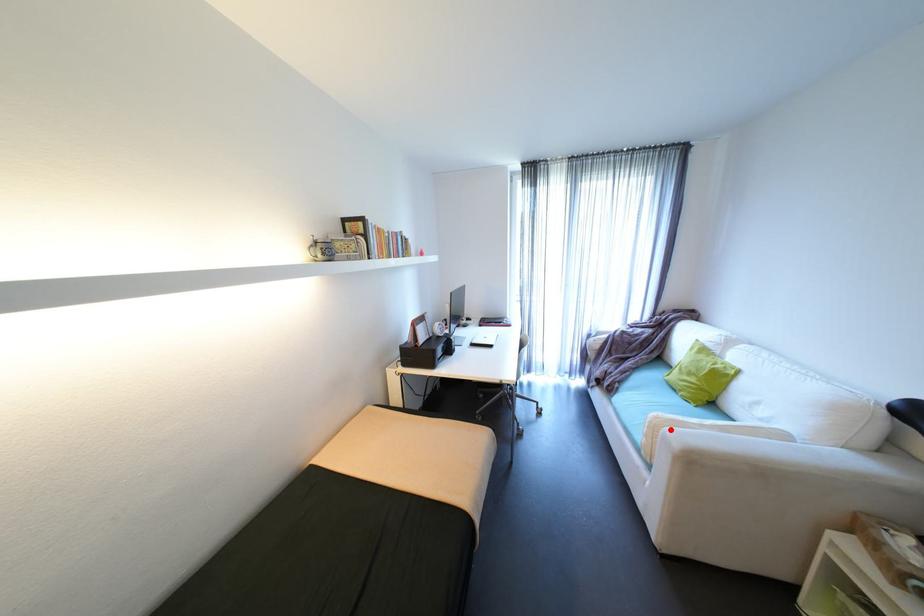
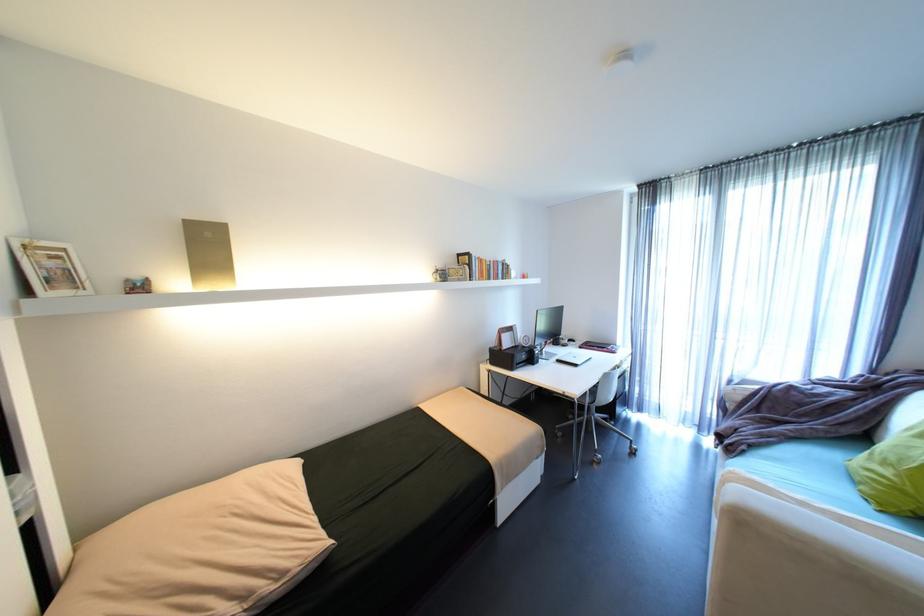
The point at the highlighted location is marked in the first image. Where is the corresponding point in the second image?

(737, 485)